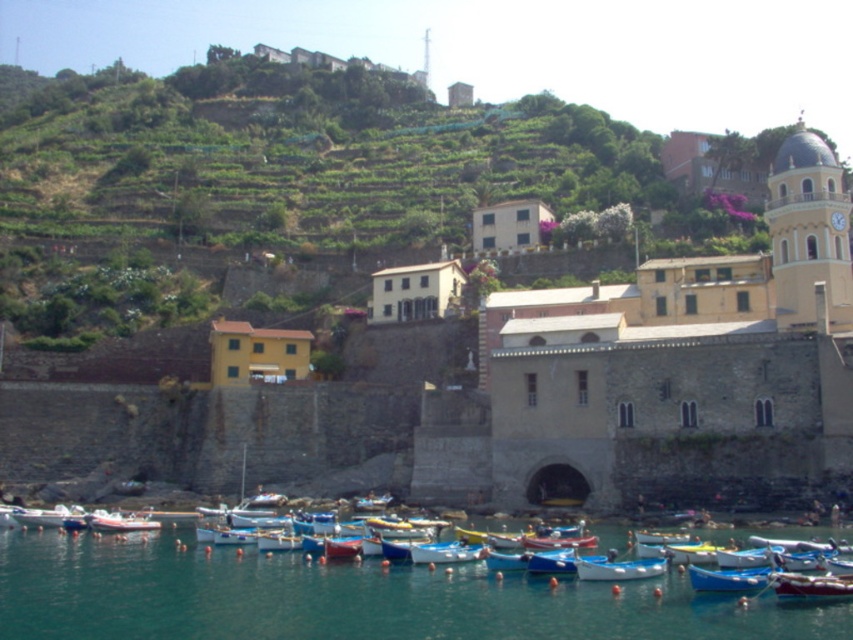
You are a tourist visiting the coastal town and want to rent a boat for a short trip. You see the blue plastic boat at lower center and the blue glossy boat at center. Which boat would be more suitable for a child to ride in?

The blue plastic boat at lower center is smaller in size compared to the blue glossy boat at center, making it more suitable for a child to ride in due to its compact size.

You are standing on the dock and see the clear blue water at lower center and the white plastic boat at lower left. Which object is closer to you?

The clear blue water at lower center is closer to you because it is in front of the white plastic boat at lower left.

From the picture: You are a tourist standing at the edge of the water in the coastal scene. You want to take a photo of the blue plastic boat at lower center. Where should you position yourself to capture the boat in the frame?

To capture the blue plastic boat at lower center in the frame, position yourself at the edge of the water near the lower center area, aligning your camera with the coordinates approximately at point (728, 579) where the boat is located.